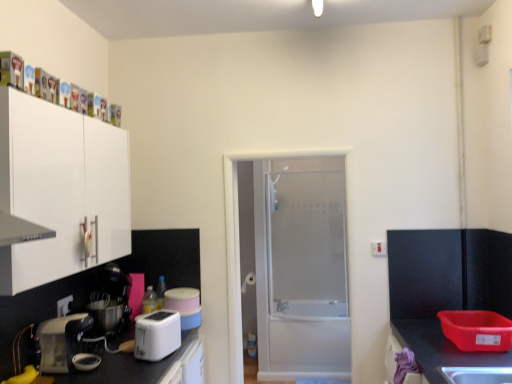
Question: In terms of height, does white plastic toaster at lower left, which is the second kitchen appliance from left to right, look taller or shorter compared to white plastic toaster at lower center, which is counted as the 2th appliance, starting from the left?

Choices:
 (A) tall
 (B) short

Answer: (A)

Question: From the image's perspective, relative to white plastic toaster at lower center, the first appliance positioned from the right, is white plastic toaster at lower left, which is the second kitchen appliance from left to right, above or below?

Choices:
 (A) above
 (B) below

Answer: (A)

Question: Which is nearer to the white plastic electric outlet at upper right, marked as the 2th electric outlet in a left-to-right arrangement?

Choices:
 (A) white plastic electric outlet at lower left, which is the 1th electric outlet in front-to-back order
 (B) white matte cabinet at upper left
 (C) white plastic toaster at lower center, the first appliance positioned from the right
 (D) white frosted glass door at center
 (E) white plastic toaster at lower left, the first kitchen appliance viewed from the right

Answer: (C)

Question: Which object is positioned closest to the white plastic toaster at lower left, which is the second kitchen appliance from right to left?

Choices:
 (A) white frosted glass door at center
 (B) white matte cabinet at upper left
 (C) white plastic electric outlet at upper right, which appears as the 1th electric outlet when viewed from the top
 (D) white plastic toaster at lower left, the first kitchen appliance viewed from the right
 (E) white plastic electric outlet at lower left, which is the 1th electric outlet in front-to-back order

Answer: (E)